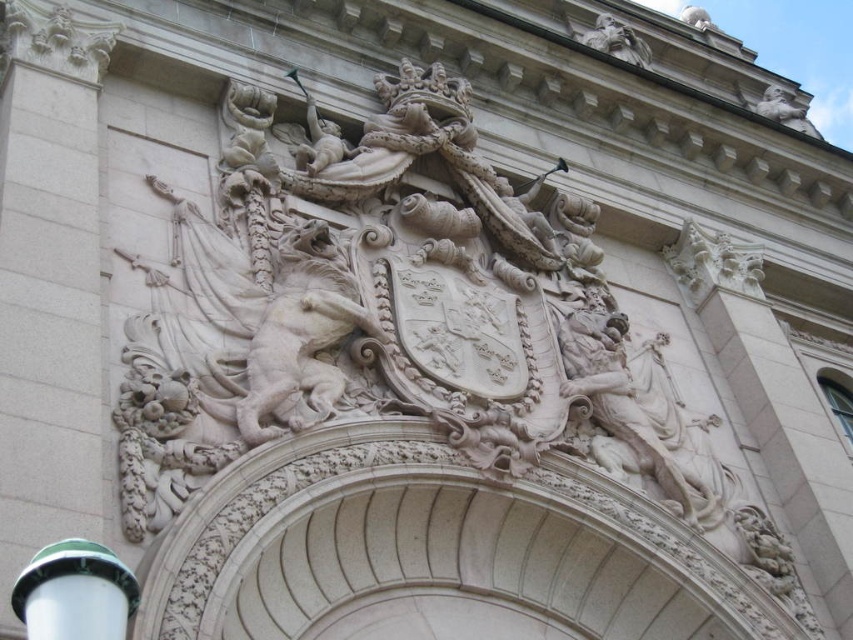
Is point (624, 426) farther from viewer compared to point (32, 608)?

Yes, point (624, 426) is behind point (32, 608).

Does white stone coat of arms at center have a lesser height compared to green plastic lamp post at lower left?

No.

Is point (676, 449) more distant than point (33, 630)?

Yes, point (676, 449) is farther from viewer.

This screenshot has width=853, height=640. I want to click on white stone coat of arms at center, so click(x=393, y=316).

Describe the element at coordinates (393, 316) in the screenshot. I see `white stone coat of arms at center` at that location.

Between white stone coat of arms at center and carved stone face at upper center, which one is positioned lower?

white stone coat of arms at center is lower down.

Describe the element at coordinates (393, 316) in the screenshot. I see `white stone coat of arms at center` at that location.

Locate an element on the screen. The height and width of the screenshot is (640, 853). white stone coat of arms at center is located at coordinates (393, 316).

Is green plastic lamp post at lower left closer to the viewer compared to carved stone face at upper center?

Yes, it is in front of carved stone face at upper center.

Measure the distance between green plastic lamp post at lower left and carved stone face at upper center.

green plastic lamp post at lower left and carved stone face at upper center are 284.55 feet apart from each other.

Is point (119, 620) positioned behind point (619, 44)?

No, it is in front of (619, 44).

Locate an element on the screen. The image size is (853, 640). green plastic lamp post at lower left is located at coordinates (74, 593).